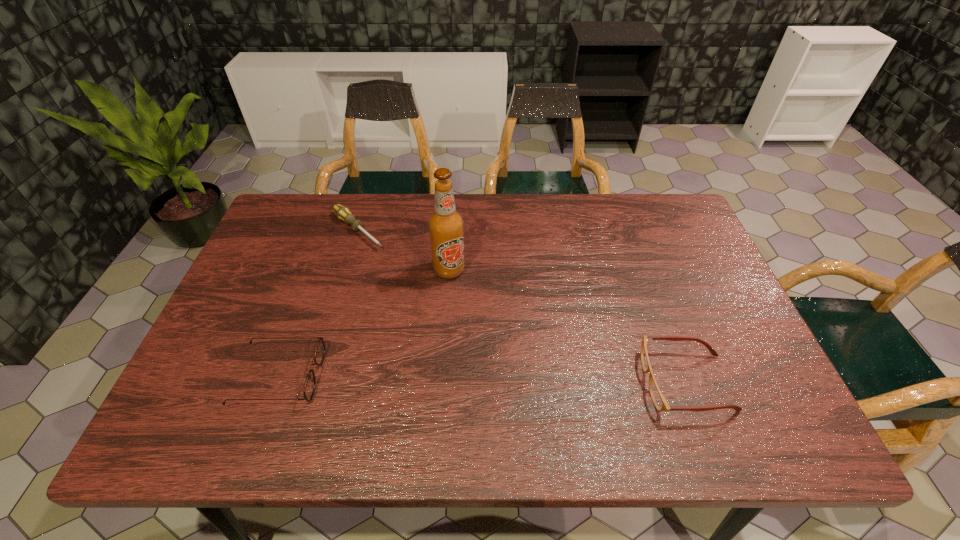
I want to click on object that is at the right edge, so click(x=658, y=398).

Find the location of a particular element. Image resolution: width=960 pixels, height=540 pixels. object present at the near left corner is located at coordinates (309, 388).

Identify the location of object located in the near right corner section of the desktop. (658, 398).

Where is `blank area at the far edge`? The image size is (960, 540). blank area at the far edge is located at coordinates (606, 200).

This screenshot has height=540, width=960. Find the location of `vacant space at the near edge`. vacant space at the near edge is located at coordinates (611, 389).

Find the location of `free space at the left edge of the desktop`. free space at the left edge of the desktop is located at coordinates (266, 308).

Locate an element on the screen. The height and width of the screenshot is (540, 960). vacant area at the right edge of the desktop is located at coordinates (682, 281).

Locate an element on the screen. vacant area at the far left corner is located at coordinates (321, 201).

Where is `free space at the near right corner of the desktop`? The height and width of the screenshot is (540, 960). free space at the near right corner of the desktop is located at coordinates (751, 383).

At what (x,y) coordinates should I click in order to perform the action: click on vacant space that is in between the shortest object and the beer bottle. Please return your answer as a coordinate pair (x, y). This screenshot has height=540, width=960. Looking at the image, I should click on (403, 251).